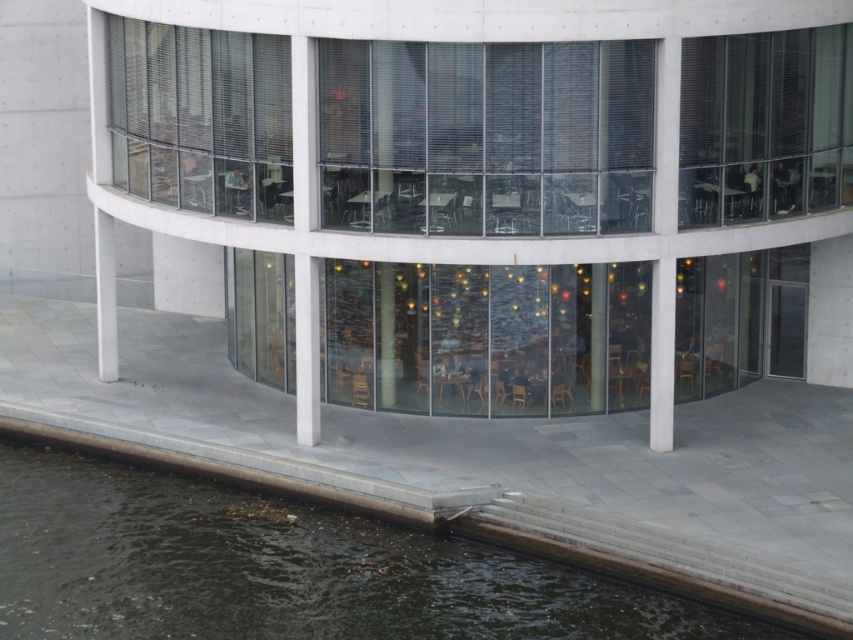
Question: Does white smooth pillar at center have a larger size compared to matte glass pillar at center?

Choices:
 (A) no
 (B) yes

Answer: (B)

Question: Based on their relative distances, which object is farther from the white smooth pillar at center?

Choices:
 (A) matte glass pillar at center
 (B) dark water at lower left

Answer: (B)

Question: Can you confirm if white concrete pillar at center is bigger than white concrete pillar at lower left?

Choices:
 (A) no
 (B) yes

Answer: (B)

Question: Which point is farther from the camera taking this photo?

Choices:
 (A) (840, 35)
 (B) (403, 80)
 (C) (653, 301)

Answer: (A)

Question: From the image, what is the correct spatial relationship of dark water at lower left in relation to matte glass pillar at center?

Choices:
 (A) left
 (B) right

Answer: (A)

Question: Which of these objects is positioned closest to the transparent glass window at center?

Choices:
 (A) white concrete pillar at center
 (B) matte glass pillar at center

Answer: (A)